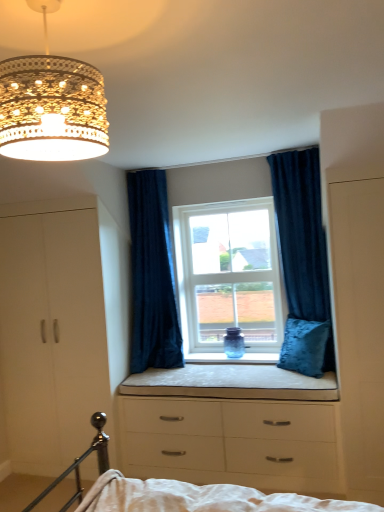
Question: In terms of width, does beige fabric cushion at center look wider or thinner when compared to velvet dark blue curtain at center, acting as the first curtain starting from the left?

Choices:
 (A) thin
 (B) wide

Answer: (B)

Question: Is beige fabric cushion at center inside or outside of velvet dark blue curtain at center, placed as the 2th curtain when sorted from right to left?

Choices:
 (A) inside
 (B) outside

Answer: (B)

Question: Estimate the real-world distances between objects in this image. Which object is closer to the white matte wardrobe at right?

Choices:
 (A) white glass window at center
 (B) white matte dresser at left
 (C) white matte chest of drawers at lower center
 (D) velvet blue curtain at upper right, which appears as the 1th curtain when viewed from the right
 (E) gold crystal chandelier at upper left

Answer: (D)

Question: Which of these objects is positioned closest to the velvet blue pillow at center?

Choices:
 (A) velvet blue curtain at upper right, which is counted as the 2th curtain, starting from the left
 (B) beige fabric cushion at center
 (C) gold crystal chandelier at upper left
 (D) white matte wardrobe at right
 (E) white glass window at center

Answer: (B)